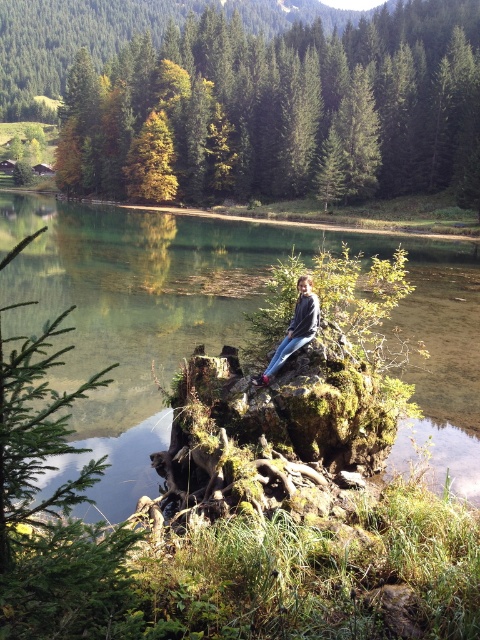
You are standing at the edge of the lake and want to find the green matte tree at center. Based on your position, in which direction should you look to see the tree?

The green matte tree at center is located at point coordinates, so you should look towards the center of the scene to find it.

You are a photographer standing at the edge of the lake. You want to take a picture of the blue jeans at center and the clear water at center. Which object is closer to you, the photographer?

The clear water at center is closer to you because the blue jeans at center is behind it.